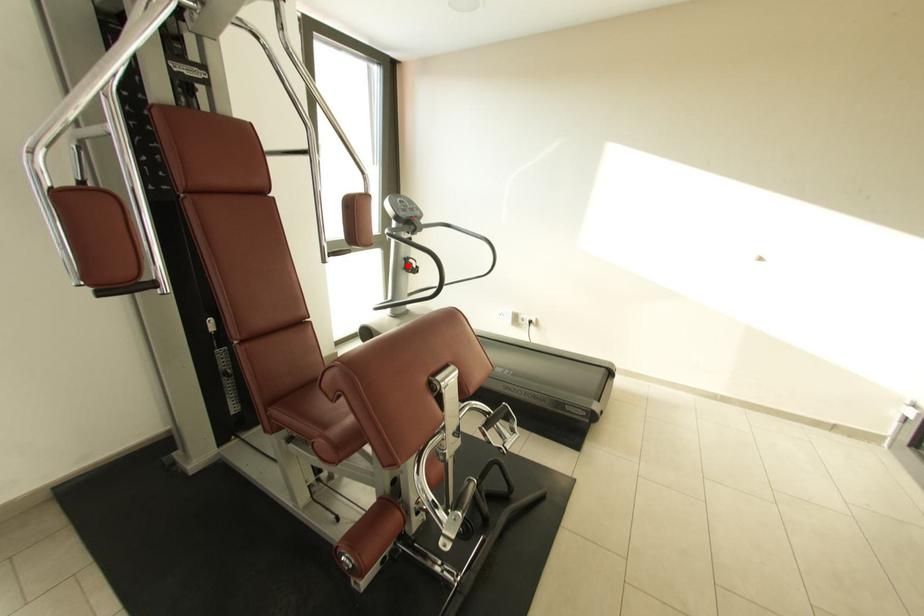
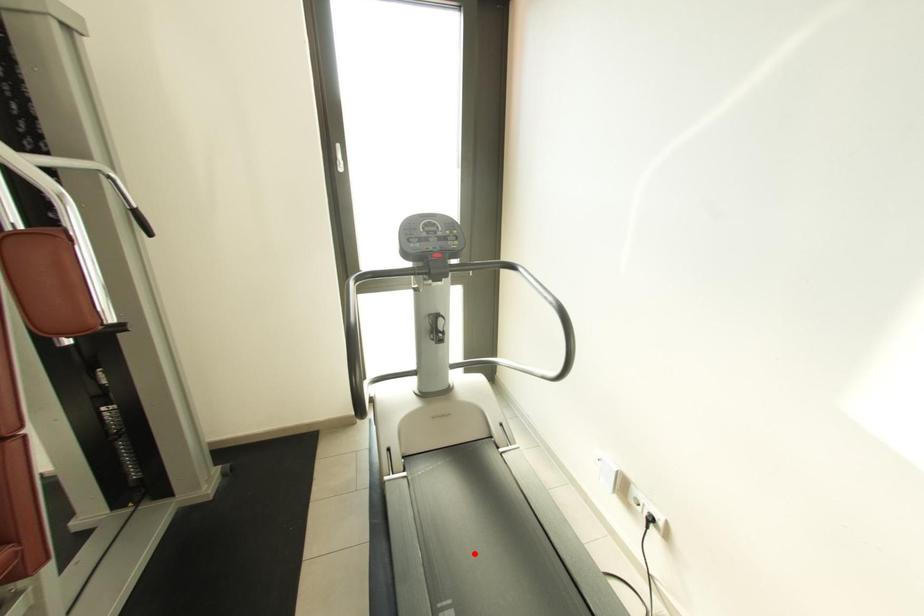
I am providing you with two images of the same scene from different viewpoints. A red point is marked on the first image and another point is marked on the second image. Do the highlighted points in image1 and image2 indicate the same real-world spot?

No